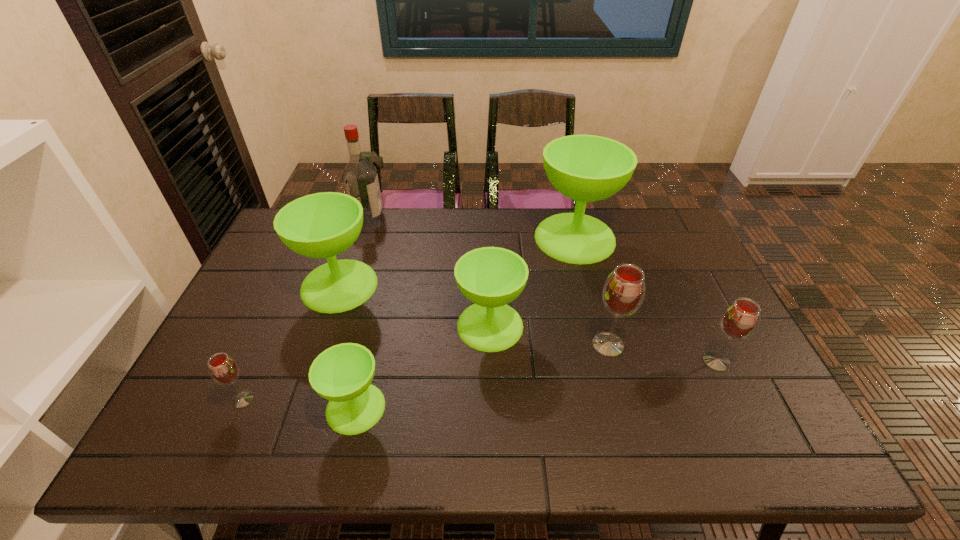
Locate which green wineglass ranks second in proximity to the third smallest green wineglass. Please provide its 2D coordinates. Your answer should be formatted as a tuple, i.e. [(x, y)], where the tuple contains the x and y coordinates of a point satisfying the conditions above.

[(490, 277)]

Where is `red wineglass that can be found as the closest to the second biggest red wineglass`? red wineglass that can be found as the closest to the second biggest red wineglass is located at coordinates (623, 293).

You are a GUI agent. You are given a task and a screenshot of the screen. Output one action in this format:
    pyautogui.click(x=<x>, y=<y>)
    Task: Click on the red wineglass that stands as the closest to the second red wineglass from right to left
    The width and height of the screenshot is (960, 540).
    Given the screenshot: What is the action you would take?
    pyautogui.click(x=740, y=319)

Image resolution: width=960 pixels, height=540 pixels. What are the coordinates of `vacant area that satisfies the following two spatial constraints: 1. on the front-facing side of the second red wineglass from right to left; 2. on the left side of the liquor` in the screenshot? It's located at (328, 345).

Locate an element on the screen. free space that satisfies the following two spatial constraints: 1. on the front side of the second red wineglass from left to right; 2. on the left side of the tallest wineglass is located at coordinates (602, 345).

The height and width of the screenshot is (540, 960). I want to click on vacant space that satisfies the following two spatial constraints: 1. on the back side of the rightmost green wineglass; 2. on the left side of the second biggest green wineglass, so pos(355,238).

At what (x,y) coordinates should I click in order to perform the action: click on vacant area in the image that satisfies the following two spatial constraints: 1. on the back side of the biggest red wineglass; 2. on the left side of the smallest green wineglass. Please return your answer as a coordinate pair (x, y). This screenshot has height=540, width=960. Looking at the image, I should click on pyautogui.click(x=371, y=345).